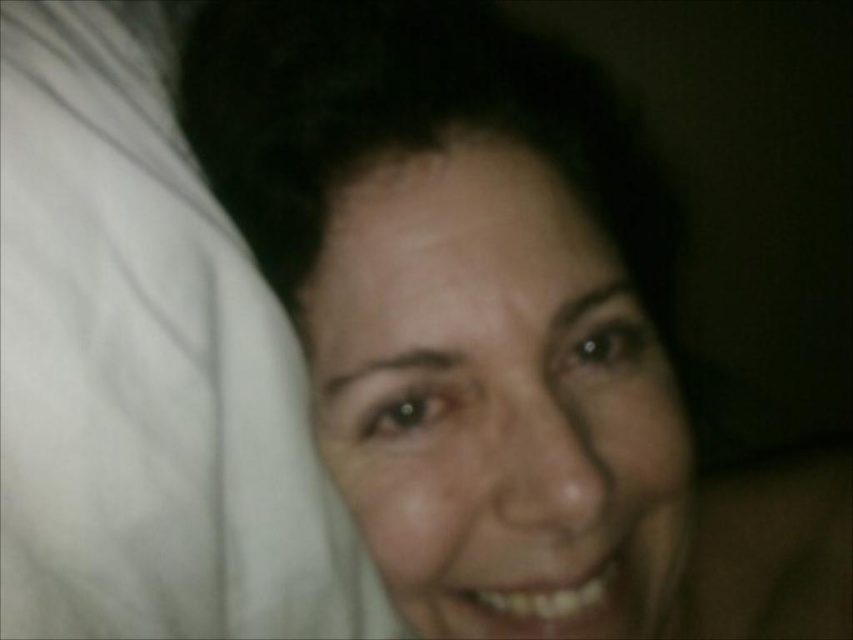
Can you confirm if white soft fabric at left is positioned to the left of smooth skin face at center?

Correct, you'll find white soft fabric at left to the left of smooth skin face at center.

Does white soft fabric at left have a lesser height compared to smooth skin face at center?

No, white soft fabric at left is not shorter than smooth skin face at center.

The image size is (853, 640). In order to click on white soft fabric at left in this screenshot , I will do `click(146, 371)`.